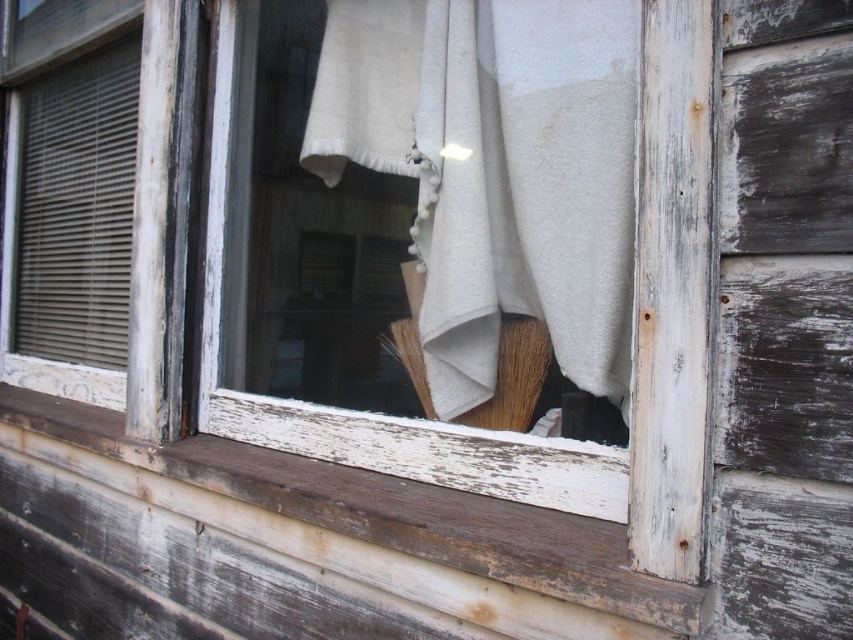
You are standing outside the window and want to reach the white cotton cloth at center. Based on its 2D coordinates, is the cloth located closer to the top or bottom of the window?

The white cotton cloth at center is located at coordinates 0.294 on the x axis and 0.620 on the y axis. Since the y axis measures vertical position with 0 being the bottom and 1 the top, a value of 0.620 means it is closer to the top of the window.

You are trying to clean a window and need to reach both the white cotton cloth at center and the weathered wood at lower center. Which object is easier to grab if you can only reach items of a certain size?

The white cotton cloth at center is smaller in size compared to the weathered wood at lower center, so it would be easier to grab if you can only reach items of a certain size.

You are standing outside the window and want to reach both the white cotton cloth at center and the brown bristle brush at center. Which object is wider?

The white cotton cloth at center is wider than the brown bristle brush at center.